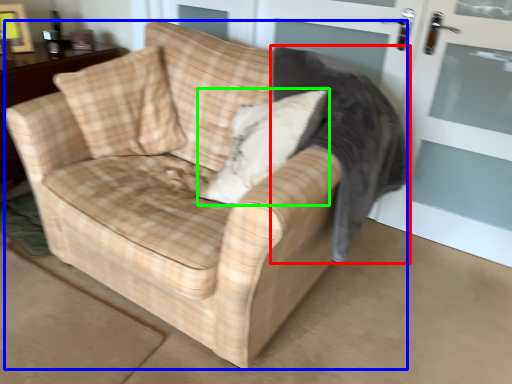
Question: Which object is positioned farthest from rocking chair (highlighted by a red box)? Select from studio couch (highlighted by a blue box) and throw pillow (highlighted by a green box).

Choices:
 (A) studio couch
 (B) throw pillow

Answer: (A)